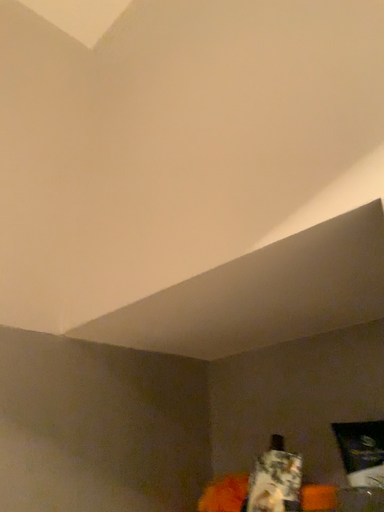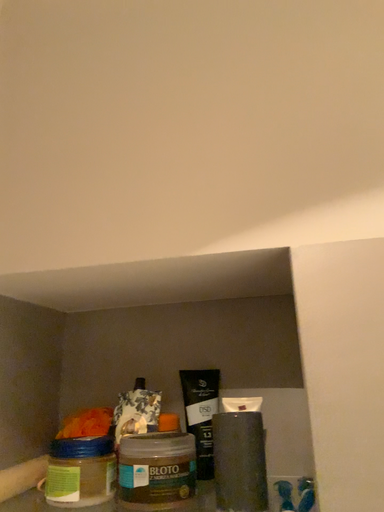
Question: How did the camera likely rotate when shooting the video?

Choices:
 (A) rotated left
 (B) rotated right

Answer: (B)